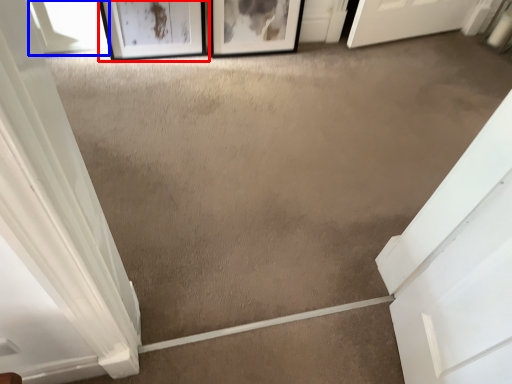
Question: Which object is further to the camera taking this photo, picture frame (highlighted by a red box) or window (highlighted by a blue box)?

Choices:
 (A) picture frame
 (B) window

Answer: (B)